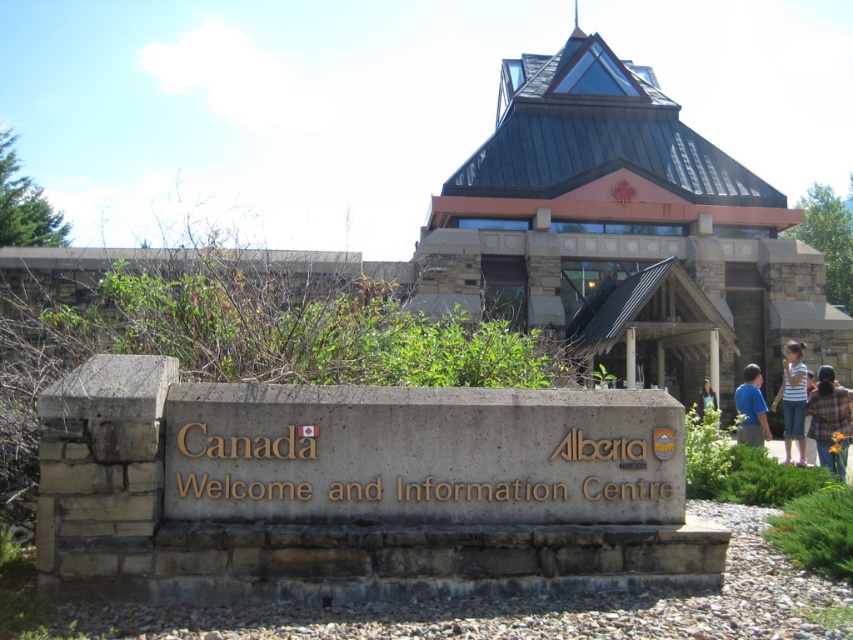
Question: Can you confirm if plaid shirt at center is positioned below blue shirt at right?

Choices:
 (A) no
 (B) yes

Answer: (B)

Question: Which point appears closest to the camera in this image?

Choices:
 (A) (700, 397)
 (B) (753, 369)
 (C) (602, 397)

Answer: (C)

Question: Which point appears closest to the camera in this image?

Choices:
 (A) (772, 410)
 (B) (708, 404)
 (C) (759, 424)
 (D) (819, 458)

Answer: (D)

Question: Considering the real-world distances, which object is farthest from the striped fabric shirt at center?

Choices:
 (A) blurred fabric person at center
 (B) plaid shirt at center

Answer: (A)

Question: Does brown concrete sign at center have a smaller size compared to blurred fabric person at center?

Choices:
 (A) no
 (B) yes

Answer: (A)

Question: Does striped fabric shirt at center appear on the left side of blue shirt at right?

Choices:
 (A) yes
 (B) no

Answer: (B)